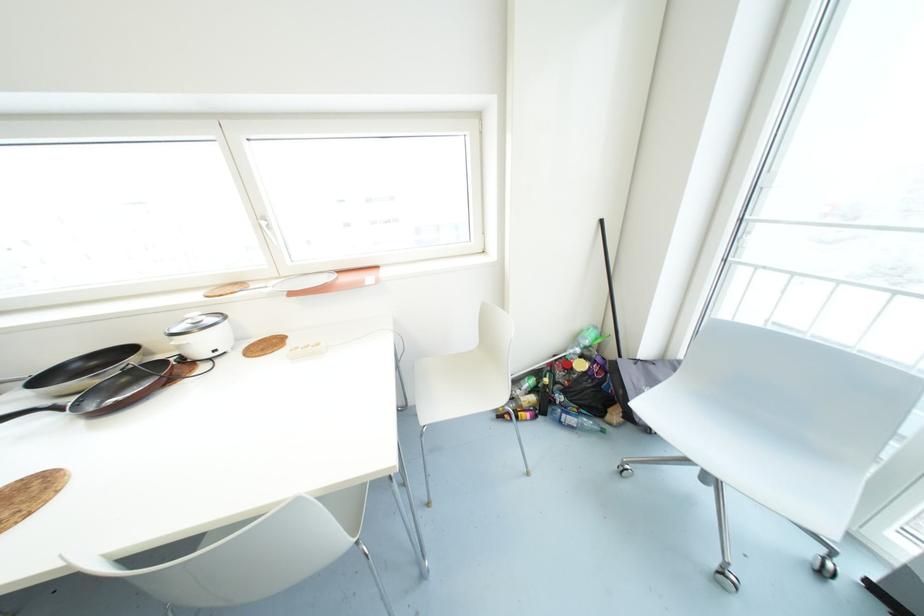
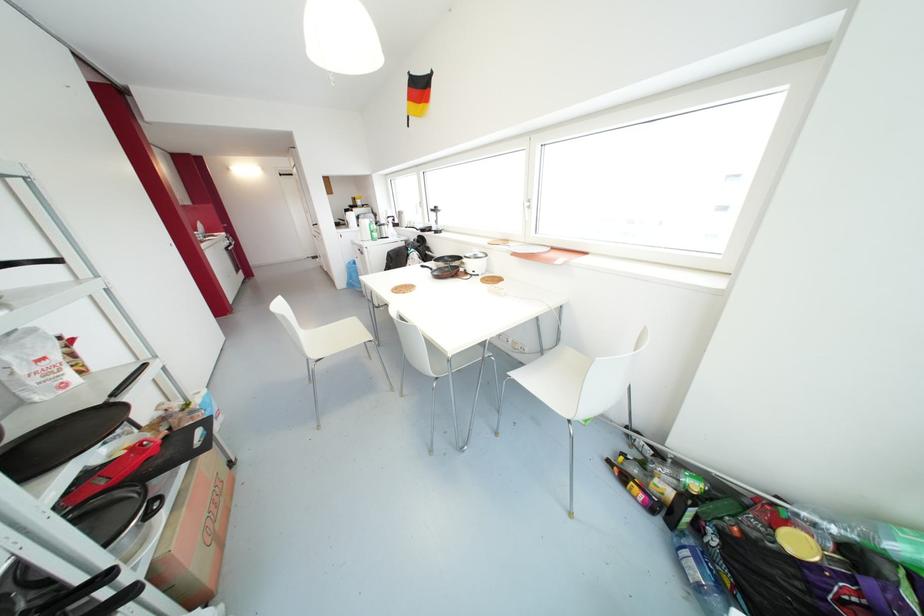
The point at (224,315) is marked in the first image. Where is the corresponding point in the second image?

(485, 254)